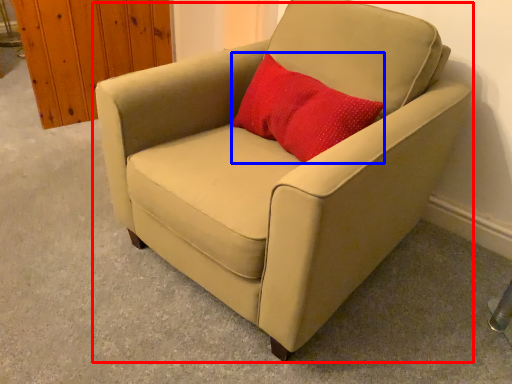
Question: Which object appears closest to the camera in this image, chair (highlighted by a red box) or throw pillow (highlighted by a blue box)?

Choices:
 (A) chair
 (B) throw pillow

Answer: (A)